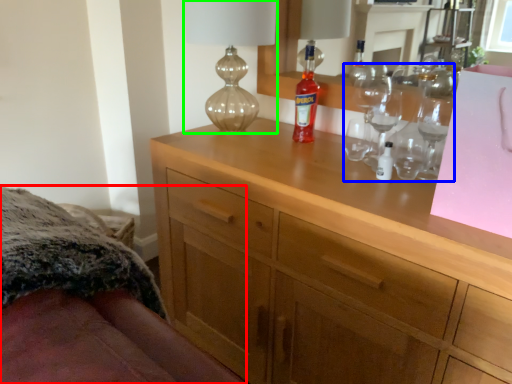
Question: Which object is positioned farthest from bed (highlighted by a red box)? Select from wine glass (highlighted by a blue box) and table lamp (highlighted by a green box).

Choices:
 (A) wine glass
 (B) table lamp

Answer: (A)